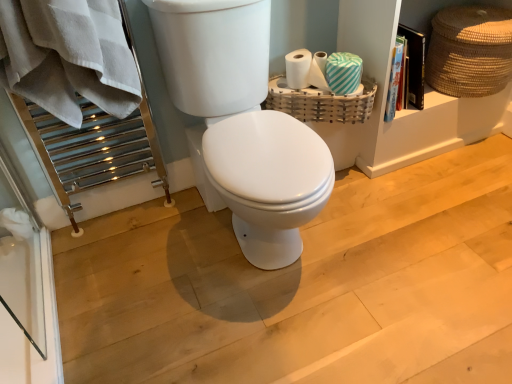
Question: From a real-world perspective, relative to white glossy toilet at center, is white textured toilet paper at upper right, the 1th toilet paper in the left-to-right sequence, vertically above or below?

Choices:
 (A) above
 (B) below

Answer: (A)

Question: Is white textured toilet paper at upper right, acting as the second toilet paper starting from the right, to the left or to the right of white glossy toilet at center in the image?

Choices:
 (A) left
 (B) right

Answer: (B)

Question: Based on their relative distances, which object is nearer to the white textured toilet paper at upper right, acting as the second toilet paper starting from the right?

Choices:
 (A) teal striped toilet paper at upper right, marked as the second toilet paper in a left-to-right arrangement
 (B) white cotton bath towel at left
 (C) woven bamboo basket at upper right, which is counted as the 2th basket, starting from the right
 (D) white glossy toilet at center
 (E) braided straw basket at upper right, the 2th basket viewed from the left

Answer: (A)

Question: Which of these objects is positioned closest to the white glossy toilet at center?

Choices:
 (A) white cotton bath towel at left
 (B) teal striped toilet paper at upper right, marked as the 1th toilet paper in a right-to-left arrangement
 (C) braided straw basket at upper right, the 2th basket viewed from the left
 (D) woven bamboo basket at upper right, which is the 1th basket from left to right
 (E) white textured toilet paper at upper right, the 1th toilet paper in the left-to-right sequence

Answer: (A)